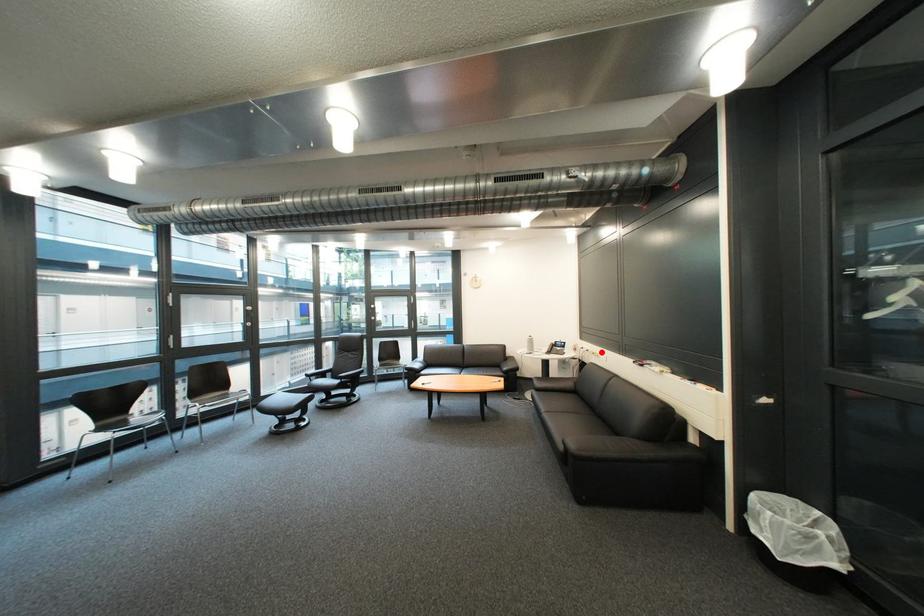
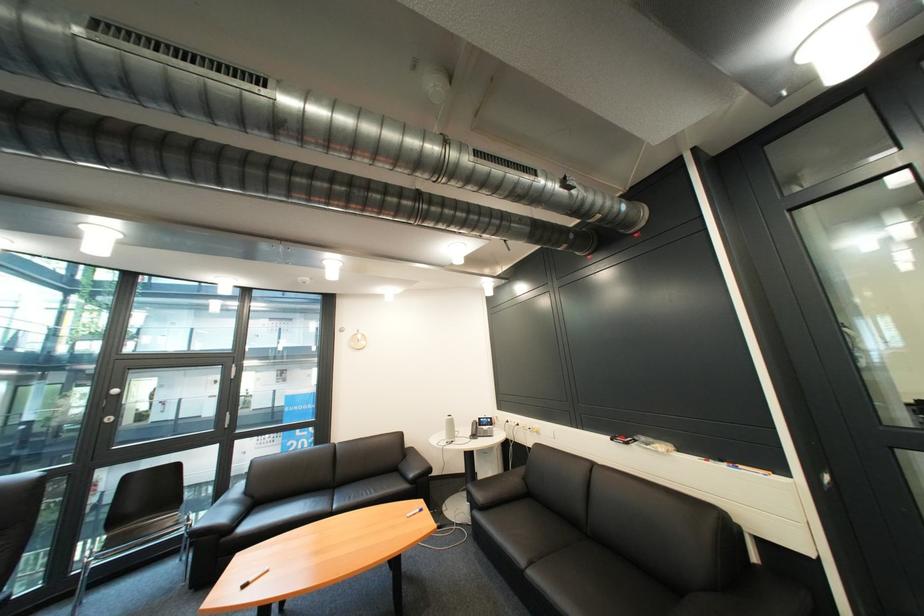
The point at the highlighted location is marked in the first image. Where is the corresponding point in the second image?

(531, 426)